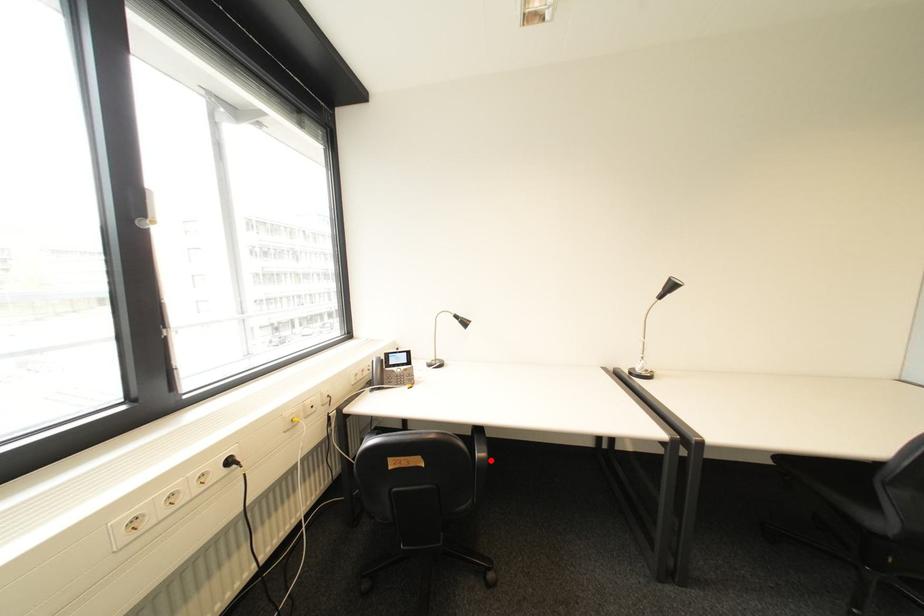
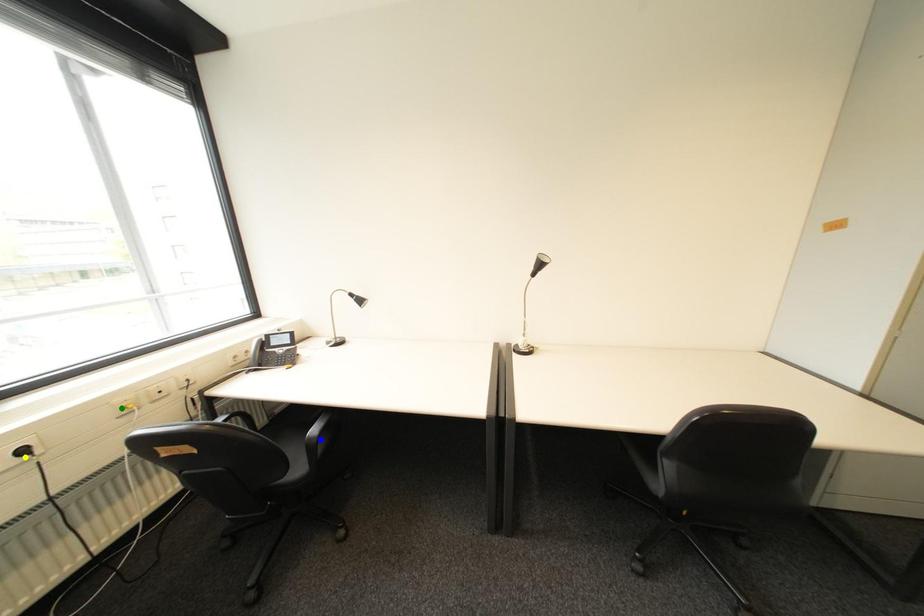
Question: I am providing you with two images of the same scene from different viewpoints. A red point is marked on the first image. You are given multiple points on the second image. Which mark in image 2 goes with the point in image 1?

Choices:
 (A) blue point
 (B) green point
 (C) yellow point

Answer: (A)